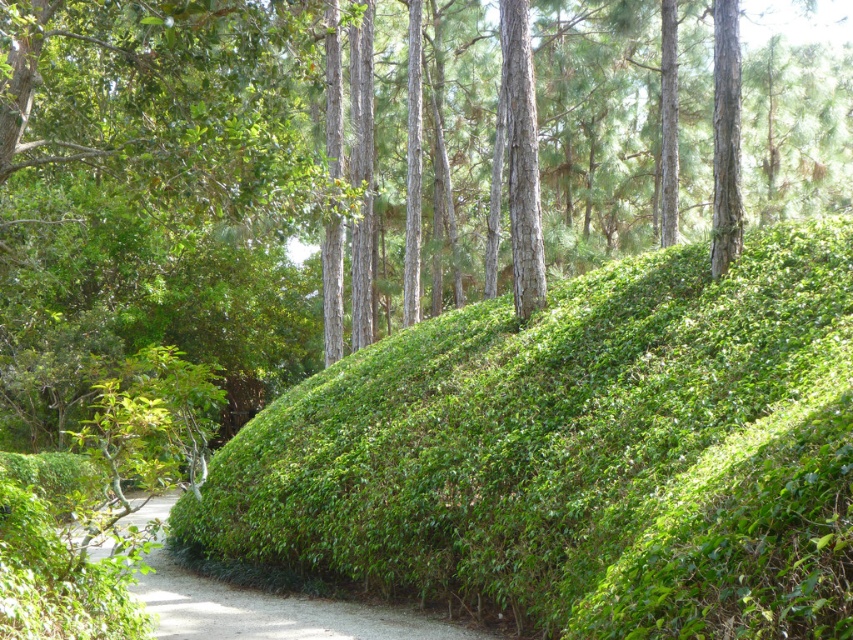
You are standing at the starting point of the pathway in the park. You notice two points marked on the map as point 1 at coordinates (234, 621) and point 2 at coordinates (514, 65). Which point is closer to you?

Point 1 at coordinates (234, 621) is closer to you since it is in front of point 2 at coordinates (514, 65).

In the scene shown: You are standing on the paved pathway in the midground and want to walk towards the green leafy hedge at lower left. Which direction should you walk relative to the smooth brown tree trunk at center?

To reach the green leafy hedge at lower left from the paved pathway, you should walk towards the direction of the green leafy hedge at lower left, which is located below the smooth brown tree trunk at center. This means you need to move downward or southward relative to the tree trunk.